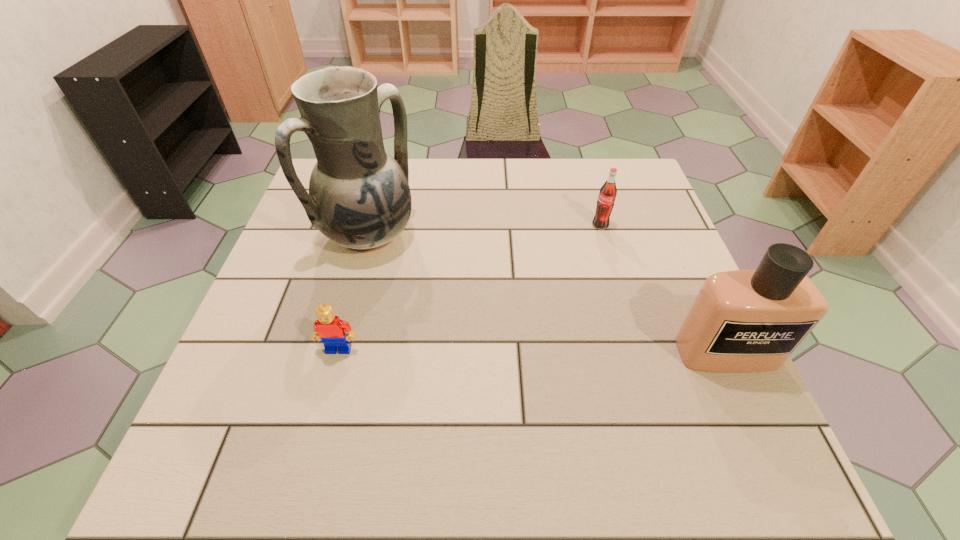
Find the location of a particular element. The image size is (960, 540). vacant space located on the label of the third tallest object is located at coordinates (575, 310).

You are a GUI agent. You are given a task and a screenshot of the screen. Output one action in this format:
    pyautogui.click(x=<x>, y=<y>)
    Task: Click on the blank area located on the front-facing side of the pitcher
    Image resolution: width=960 pixels, height=540 pixels.
    Given the screenshot: What is the action you would take?
    pyautogui.click(x=495, y=335)

Where is `free spot located 0.180m on the front-facing side of the pitcher`? free spot located 0.180m on the front-facing side of the pitcher is located at coordinates (448, 298).

Identify the location of free space located 0.300m on the front-facing side of the pitcher. (489, 330).

Image resolution: width=960 pixels, height=540 pixels. I want to click on object at the far edge, so click(x=359, y=197).

At what (x,y) coordinates should I click in order to perform the action: click on Lego that is at the left edge. Please return your answer as a coordinate pair (x, y). This screenshot has height=540, width=960. Looking at the image, I should click on (329, 328).

Locate an element on the screen. The height and width of the screenshot is (540, 960). pitcher at the left edge is located at coordinates (359, 197).

Locate an element on the screen. Image resolution: width=960 pixels, height=540 pixels. perfume that is at the right edge is located at coordinates (743, 320).

The image size is (960, 540). In order to click on soda bottle present at the right edge in this screenshot , I will do `click(605, 203)`.

Find the location of a particular element. object present at the far left corner is located at coordinates (359, 197).